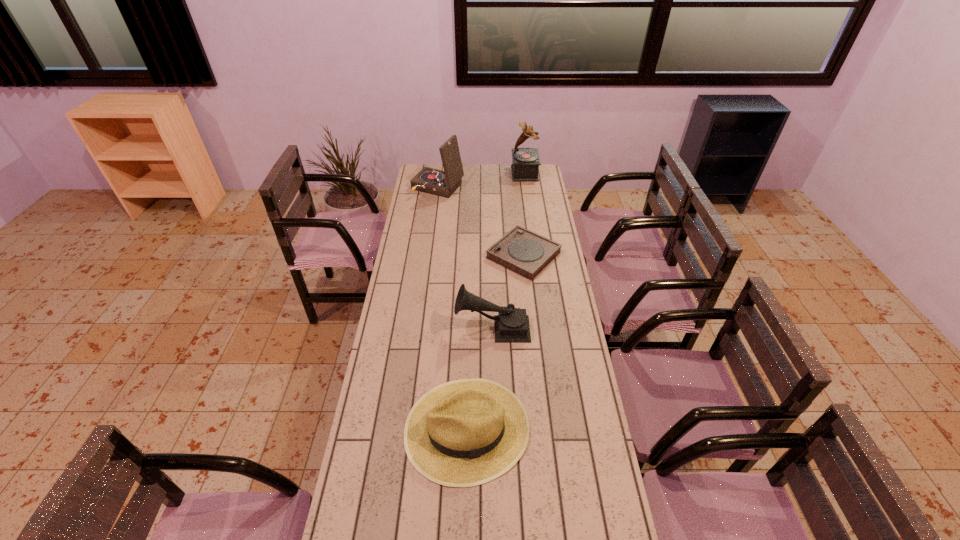
Find the location of a particular element. The width and height of the screenshot is (960, 540). object identified as the closest to the third shortest object is located at coordinates (462, 433).

This screenshot has width=960, height=540. I want to click on phonograph record that is the closest to the second nearest phonograph record, so click(x=511, y=324).

Identify which phonograph record is the second closest to the third farthest phonograph record. Please provide its 2D coordinates. Your answer should be formatted as a tuple, i.e. [(x, y)], where the tuple contains the x and y coordinates of a point satisfying the conditions above.

[(442, 183)]